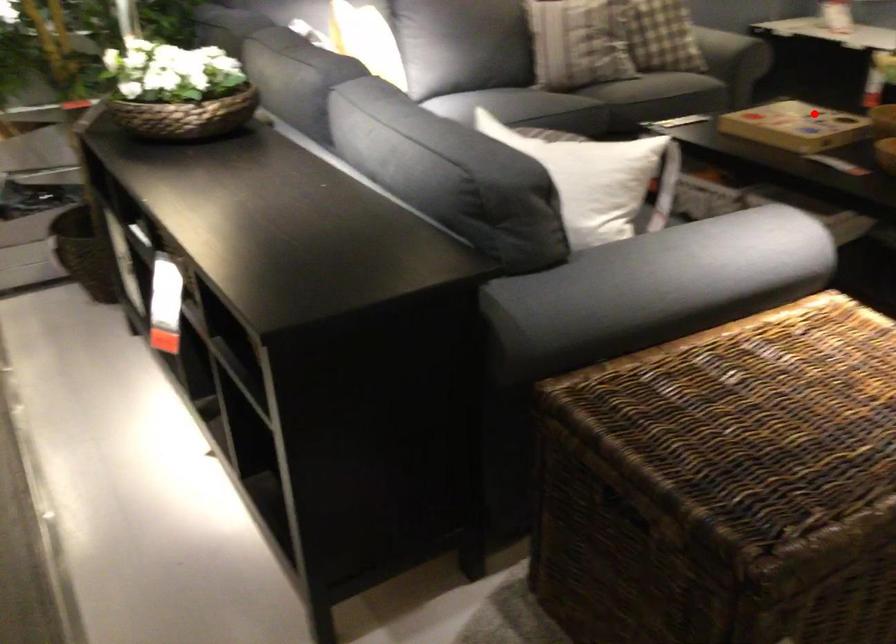
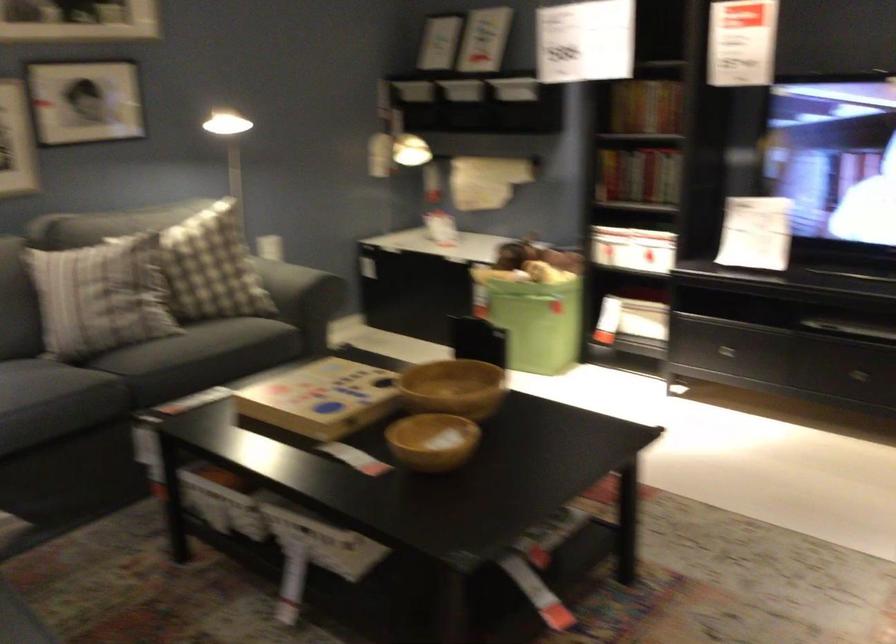
Question: I am providing you with two images of the same scene from different viewpoints. In image1, a red point is highlighted. Considering the same 3D point in image2, which of the following is correct?

Choices:
 (A) It is closer
 (B) It is farther

Answer: (A)